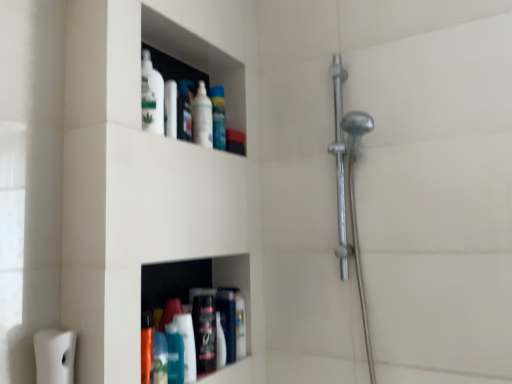
Question: In the image, is polished chrome shower at right positioned in front of or behind translucent plastic spray bottle at upper center, the second cleaning product positioned from the bottom?

Choices:
 (A) front
 (B) behind

Answer: (A)

Question: Is polished chrome shower at right wider or thinner than translucent plastic spray bottle at upper center, the 2th cleaning product viewed from the left?

Choices:
 (A) wide
 (B) thin

Answer: (A)

Question: Considering the real-world distances, which object is farthest from the translucent plastic spray bottle at upper center, the 2th cleaning product viewed from the left?

Choices:
 (A) polished chrome shower at right
 (B) white glossy bottle at upper center, which is the second mouthwash in bottom-to-top order
 (C) teal glossy bottle at lower center, marked as the second cleaning product in a back-to-front arrangement
 (D) matte black bottle at lower center, marked as the first toiletry in a bottom-to-top arrangement
 (E) blue glossy mouthwash at lower center, marked as the second mouthwash in a top-to-bottom arrangement

Answer: (E)

Question: Which object is positioned farthest from the white glossy bottle at upper center, the 2th mouthwash viewed from the front?

Choices:
 (A) white matte toilet paper at lower left
 (B) translucent plastic spray bottle at upper center, which appears as the 1th cleaning product when viewed from the back
 (C) blue glossy mouthwash at lower center, positioned as the first mouthwash in bottom-to-top order
 (D) matte plastic container at upper center, placed as the 1th toiletry when sorted from left to right
 (E) polished chrome shower at right

Answer: (A)